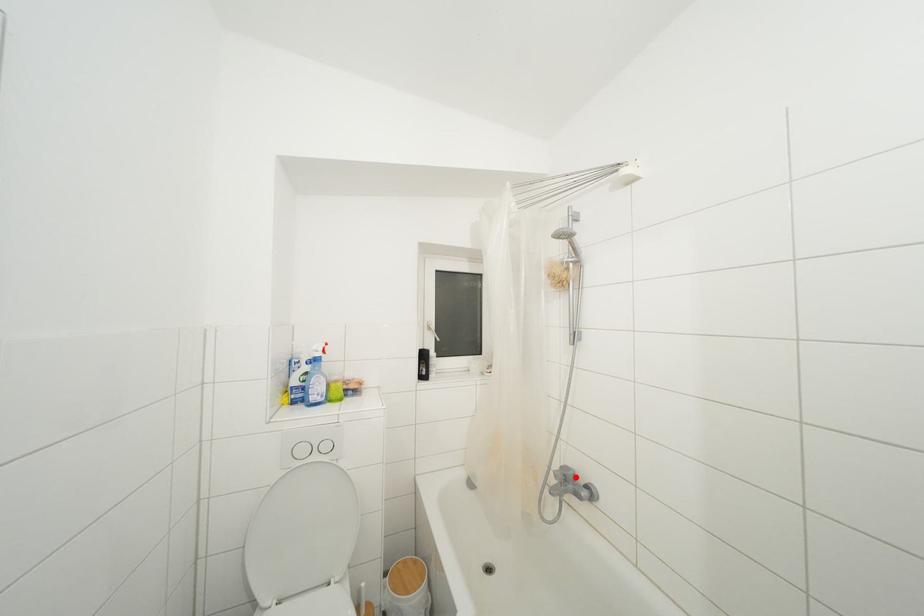
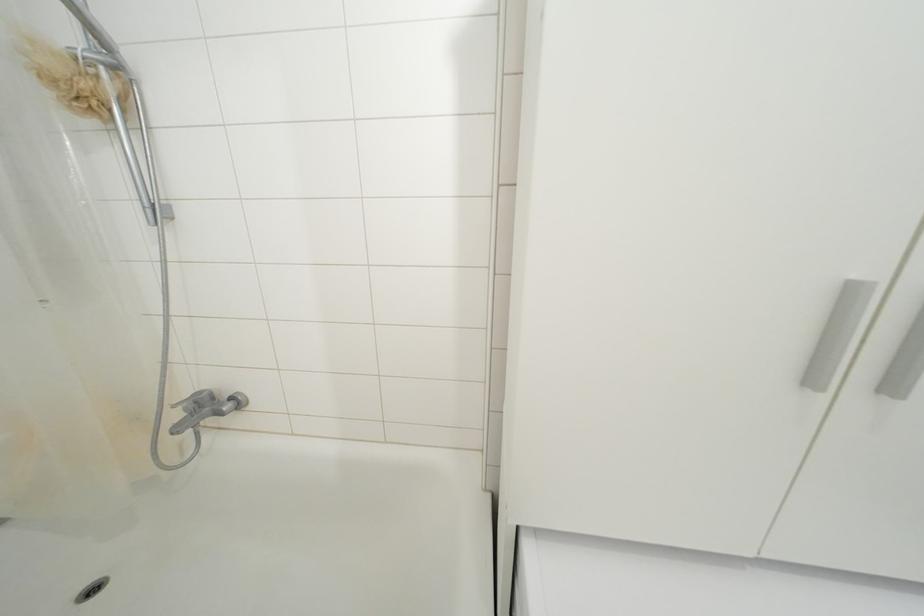
Question: I am providing you with two images of the same scene from different viewpoints. Given a red point in image1, look at the same physical point in image2. Is it:

Choices:
 (A) Closer to the viewpoint
 (B) Farther from the viewpoint

Answer: (A)